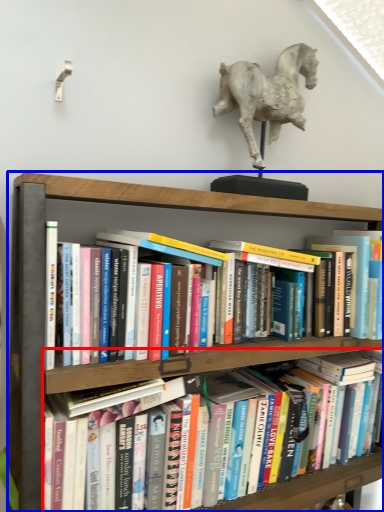
Question: Which point is further to the camera, book (highlighted by a red box) or shelf (highlighted by a blue box)?

Choices:
 (A) book
 (B) shelf

Answer: (A)